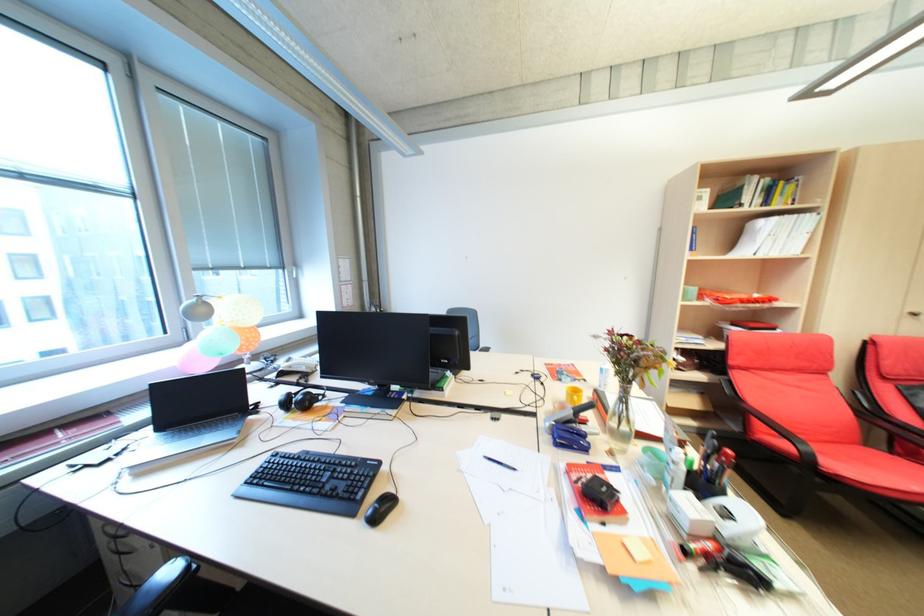
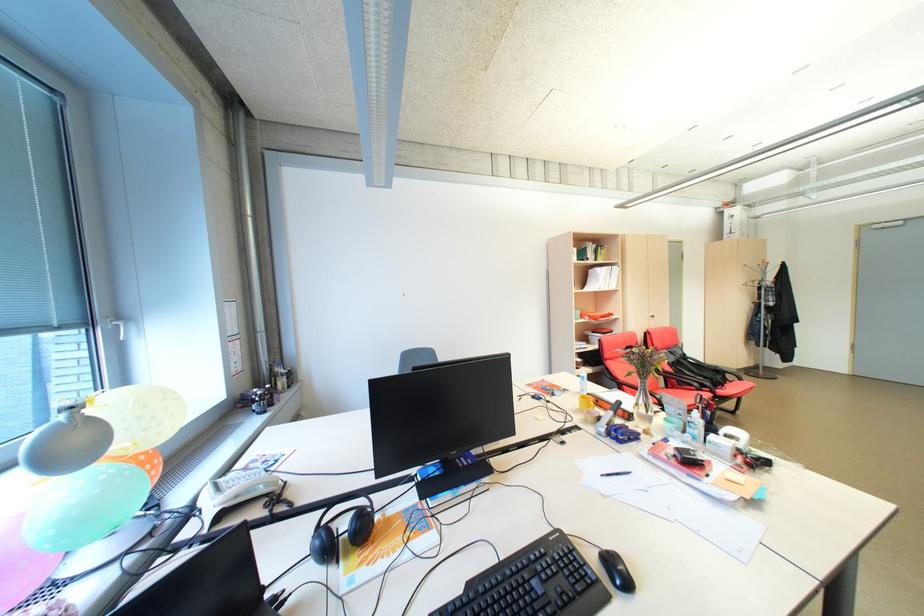
In the second image, find the point that corresponds to (699,496) in the first image.

(722, 436)